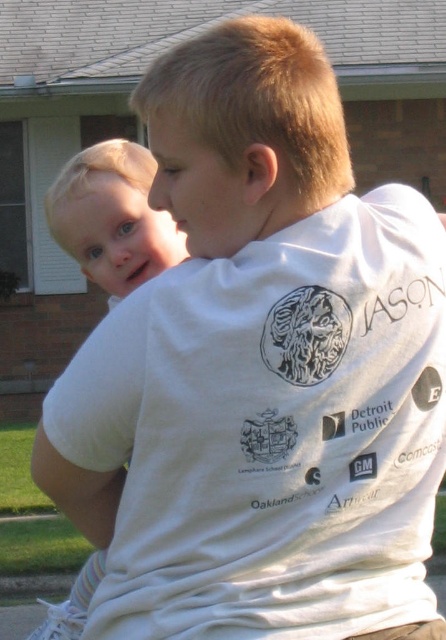
Question: Which point is closer to the camera taking this photo?

Choices:
 (A) (129, 262)
 (B) (181, 236)

Answer: (A)

Question: Does light blonde hair at left have a larger size compared to blonde hair baby at upper left?

Choices:
 (A) yes
 (B) no

Answer: (A)

Question: Which of the following is the closest to the observer?

Choices:
 (A) blonde hair baby at upper left
 (B) light blonde hair at left

Answer: (A)

Question: Can you confirm if light blonde hair at left is positioned to the left of blonde hair baby at upper left?

Choices:
 (A) no
 (B) yes

Answer: (B)

Question: Observing the image, what is the correct spatial positioning of light blonde hair at left in reference to blonde hair baby at upper left?

Choices:
 (A) right
 (B) left

Answer: (B)

Question: Which object appears farthest from the camera in this image?

Choices:
 (A) light blonde hair at left
 (B) blonde hair baby at upper left

Answer: (A)